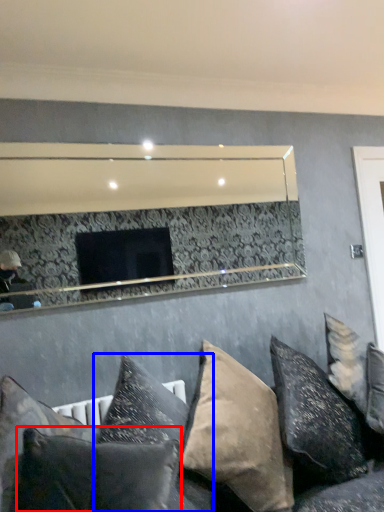
Question: Which point is further to the camera, pillow (highlighted by a red box) or pillow (highlighted by a blue box)?

Choices:
 (A) pillow
 (B) pillow

Answer: (B)